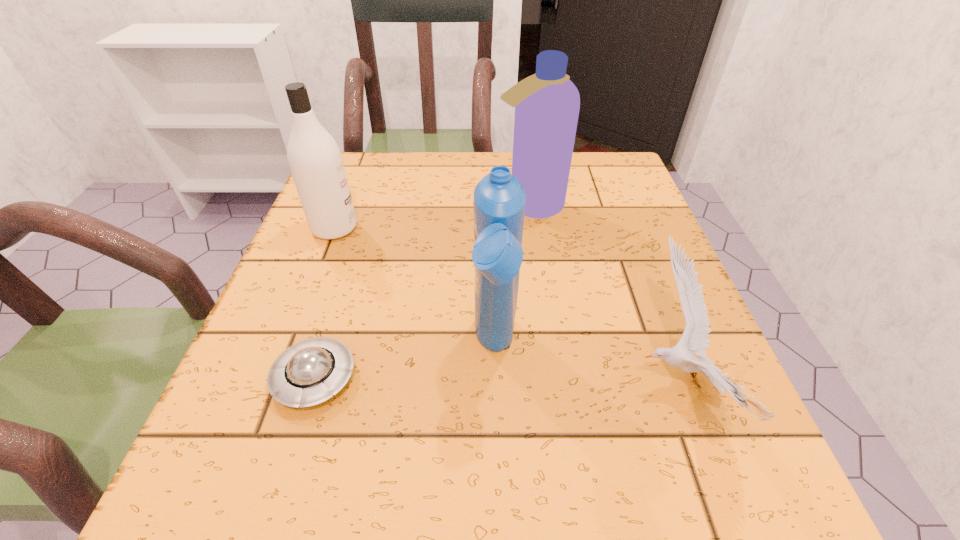
In the image, there is a desktop. Identify the location of vacant region at the far left corner. Image resolution: width=960 pixels, height=540 pixels. (369, 178).

In the image, there is a desktop. What are the coordinates of `free space at the near left corner` in the screenshot? It's located at (257, 506).

At what (x,y) coordinates should I click in order to perform the action: click on vacant region at the far right corner of the desktop. Please return your answer as a coordinate pair (x, y). This screenshot has height=540, width=960. Looking at the image, I should click on (625, 160).

The height and width of the screenshot is (540, 960). What are the coordinates of `unoccupied position between the nearest shampoo and the saucer` in the screenshot? It's located at [405, 363].

Where is `vacant point located between the shortest object and the nearest shampoo`? vacant point located between the shortest object and the nearest shampoo is located at coordinates [405, 363].

Locate an element on the screen. free spot between the nearest shampoo and the leftmost shampoo is located at coordinates (415, 288).

This screenshot has width=960, height=540. In order to click on free point between the saucer and the second shortest object in this screenshot , I will do `click(496, 380)`.

You are a GUI agent. You are given a task and a screenshot of the screen. Output one action in this format:
    pyautogui.click(x=<x>, y=<y>)
    Task: Click on the object that is the third nearest to the rightmost object
    
    Given the screenshot: What is the action you would take?
    pyautogui.click(x=310, y=372)

This screenshot has width=960, height=540. Identify the location of object that is the third closest to the nearest shampoo. (547, 103).

Find the location of `shampoo that is the closest one to the rightmost object`. shampoo that is the closest one to the rightmost object is located at coordinates (499, 199).